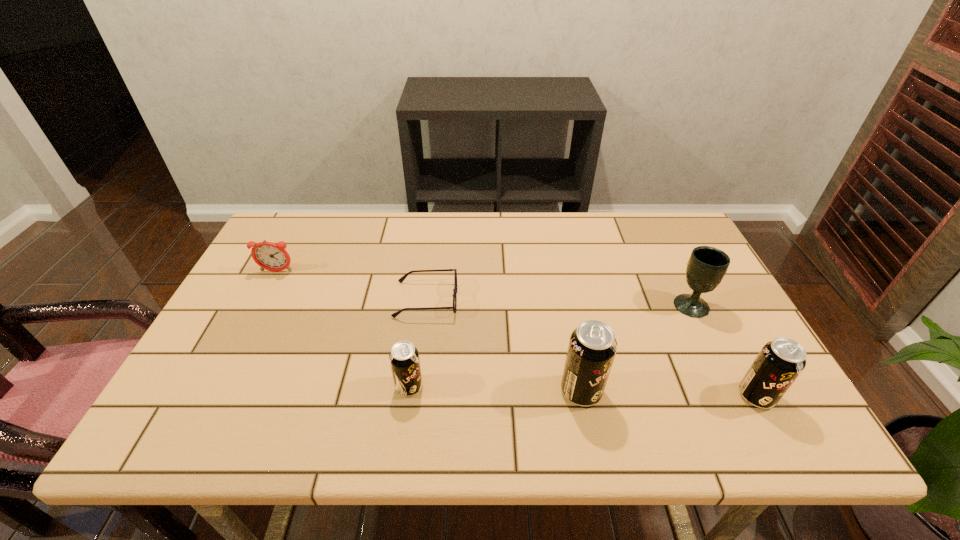
At what (x,y) coordinates should I click in order to perform the action: click on the leftmost soda can. Please return your answer as a coordinate pair (x, y). Looking at the image, I should click on (404, 359).

Image resolution: width=960 pixels, height=540 pixels. Identify the location of the second soda can from left to right. (592, 347).

Find the location of a particular element. The width and height of the screenshot is (960, 540). the tallest soda can is located at coordinates (592, 347).

At what (x,y) coordinates should I click in order to perform the action: click on the rightmost soda can. Please return your answer as a coordinate pair (x, y). This screenshot has width=960, height=540. Looking at the image, I should click on (779, 363).

This screenshot has height=540, width=960. Identify the location of the shortest object. (401, 279).

Where is `chalice`? This screenshot has width=960, height=540. chalice is located at coordinates (706, 267).

What are the coordinates of `the leftmost object` in the screenshot? It's located at (270, 256).

Where is `alarm clock`? alarm clock is located at coordinates (270, 256).

This screenshot has width=960, height=540. Find the location of `free spot located on the back of the leftmost soda can`. free spot located on the back of the leftmost soda can is located at coordinates 423,286.

This screenshot has width=960, height=540. I want to click on vacant space situated 0.060m on the right of the tallest soda can, so click(x=629, y=391).